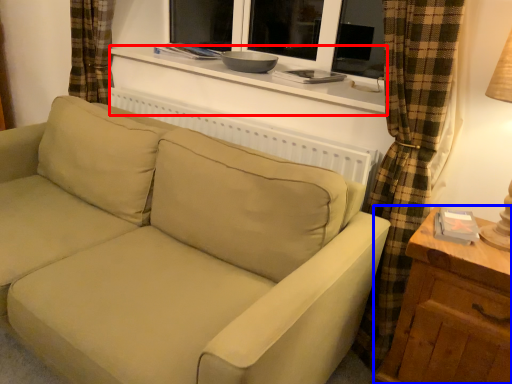
Question: Which object appears closest to the camera in this image, window sill (highlighted by a red box) or table (highlighted by a blue box)?

Choices:
 (A) window sill
 (B) table

Answer: (B)